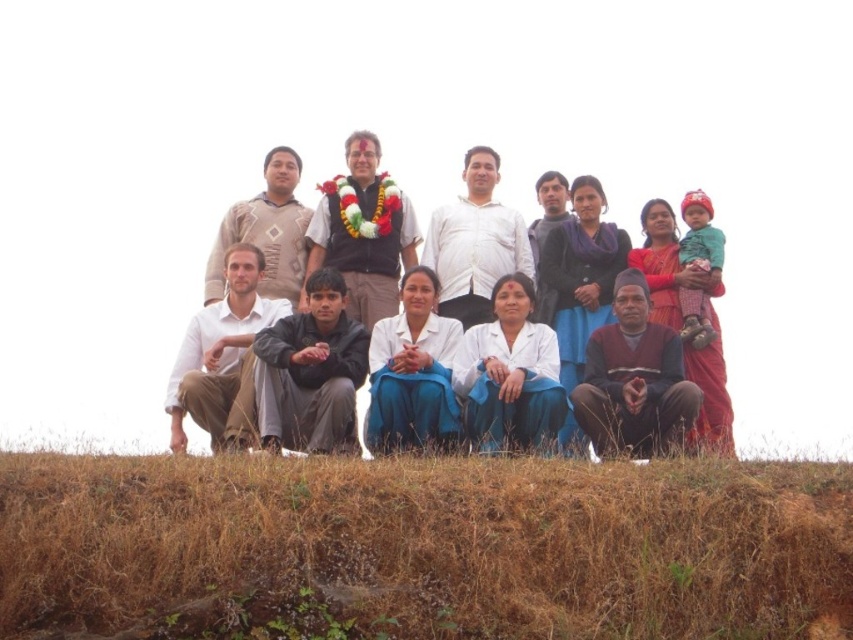
Question: Can you confirm if white cotton shirt at center is positioned above white shirt at center?

Choices:
 (A) no
 (B) yes

Answer: (A)

Question: Which object appears farthest from the camera in this image?

Choices:
 (A) white cotton shirt at lower left
 (B) dark gray jacket at center
 (C) brown dry grass at lower center

Answer: (A)

Question: Does white cotton shirt at center have a lesser width compared to maroon sweater at lower center?

Choices:
 (A) no
 (B) yes

Answer: (A)

Question: Is maroon sweater at lower center wider than white cotton shirt at lower left?

Choices:
 (A) no
 (B) yes

Answer: (B)

Question: Which object is farther from the camera taking this photo?

Choices:
 (A) brown dry grass at lower center
 (B) white cotton shirt at center
 (C) knitted beige sweater at upper center

Answer: (C)

Question: Estimate the real-world distances between objects in this image. Which object is farther from the maroon sweater at lower center?

Choices:
 (A) matte black shirt at center
 (B) brown dry grass at lower center
 (C) dark gray jacket at center

Answer: (A)